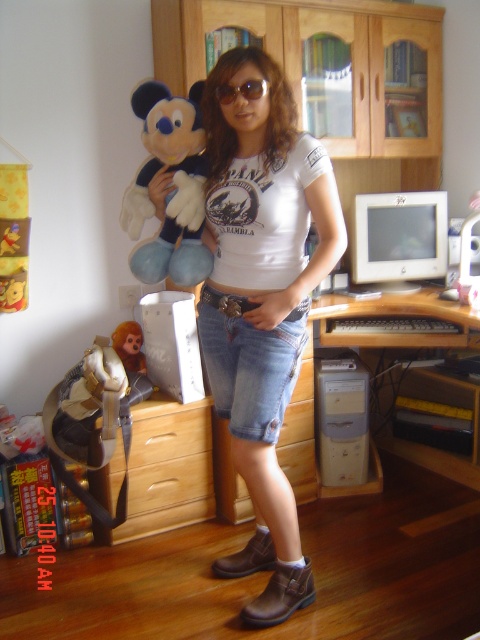
Question: Can you confirm if wooden dresser at center is positioned above soft plush monkey at lower left?

Choices:
 (A) yes
 (B) no

Answer: (A)

Question: Which point is closer to the camera taking this photo?

Choices:
 (A) (365, 448)
 (B) (252, 93)

Answer: (B)

Question: Does wooden dresser at center appear over gold metallic sunglasses at center?

Choices:
 (A) no
 (B) yes

Answer: (B)

Question: Which object is farther from the camera taking this photo?

Choices:
 (A) wooden at left
 (B) white plastic computer desk at center

Answer: (A)

Question: Based on their relative distances, which object is farther from the wooden at left?

Choices:
 (A) gold metallic sunglasses at center
 (B) white glossy monitor at center right
 (C) white plastic computer tower at lower center

Answer: (A)

Question: Considering the relative positions of white plastic computer desk at center and gold metallic sunglasses at center in the image provided, where is white plastic computer desk at center located with respect to gold metallic sunglasses at center?

Choices:
 (A) left
 (B) right

Answer: (B)